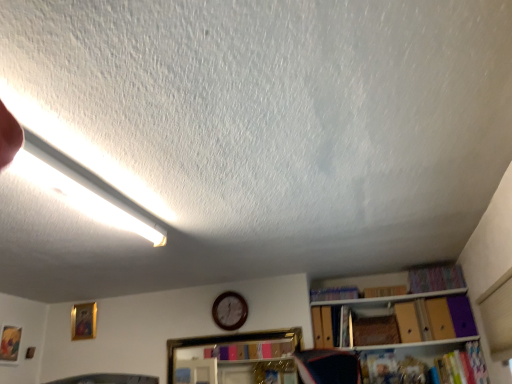
Question: Is blue fabric book at center, acting as the third book starting from the top, next to multicolored fabric book at upper right, marked as the 4th book in a bottom-to-top arrangement, and touching it?

Choices:
 (A) no
 (B) yes

Answer: (A)

Question: Does blue fabric book at center, which appears as the 2th book when ordered from the bottom, have a lesser width compared to multicolored fabric book at upper right, marked as the 4th book in a bottom-to-top arrangement?

Choices:
 (A) yes
 (B) no

Answer: (A)

Question: Is blue fabric book at center, which appears as the 2th book when ordered from the bottom, further to camera compared to multicolored fabric book at upper right, the 1th book from the top?

Choices:
 (A) yes
 (B) no

Answer: (A)

Question: Is blue fabric book at center, which appears as the 2th book when ordered from the bottom, closer to camera compared to multicolored fabric book at upper right, marked as the 4th book in a bottom-to-top arrangement?

Choices:
 (A) yes
 (B) no

Answer: (B)

Question: Could you tell me if blue fabric book at center, acting as the third book starting from the top, is turned towards multicolored fabric book at upper right, the 1th book from the top?

Choices:
 (A) no
 (B) yes

Answer: (A)

Question: Is multicolored fabric book at upper right, marked as the 4th book in a bottom-to-top arrangement, located within blue fabric book at center, acting as the third book starting from the top?

Choices:
 (A) yes
 (B) no

Answer: (B)

Question: Is purple cardboard book at upper right, the third book ordered from the bottom, far from multicolored fabric book at upper right, marked as the 4th book in a bottom-to-top arrangement?

Choices:
 (A) yes
 (B) no

Answer: (B)

Question: Is purple cardboard book at upper right, the third book ordered from the bottom, facing away from multicolored fabric book at upper right, the 1th book from the top?

Choices:
 (A) no
 (B) yes

Answer: (A)

Question: From the image's perspective, is purple cardboard book at upper right, the third book ordered from the bottom, beneath multicolored fabric book at upper right, the 1th book from the top?

Choices:
 (A) no
 (B) yes

Answer: (B)

Question: From the image's perspective, is purple cardboard book at upper right, placed as the second book when sorted from top to bottom, on top of multicolored fabric book at upper right, the 1th book from the top?

Choices:
 (A) no
 (B) yes

Answer: (A)

Question: Is purple cardboard book at upper right, placed as the second book when sorted from top to bottom, placed right next to multicolored fabric book at upper right, the 1th book from the top?

Choices:
 (A) yes
 (B) no

Answer: (B)

Question: Can you confirm if purple cardboard book at upper right, the third book ordered from the bottom, is taller than multicolored fabric book at upper right, the 1th book from the top?

Choices:
 (A) no
 (B) yes

Answer: (A)

Question: Considering the relative sizes of gold-framed picture at upper left, the 2th picture frame from the left, and white fluorescent tube at upper left in the image provided, is gold-framed picture at upper left, the 2th picture frame from the left, taller than white fluorescent tube at upper left?

Choices:
 (A) no
 (B) yes

Answer: (B)